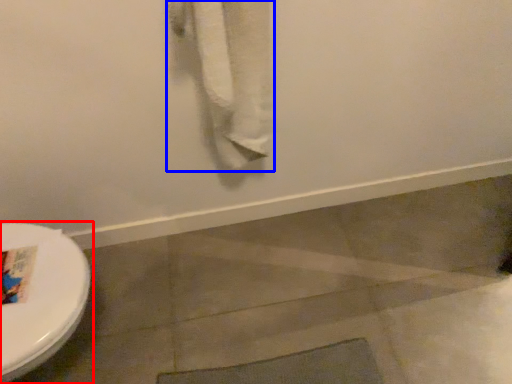
Question: Which of the following is the farthest to the observer, toilet (highlighted by a red box) or bath towel (highlighted by a blue box)?

Choices:
 (A) toilet
 (B) bath towel

Answer: (A)